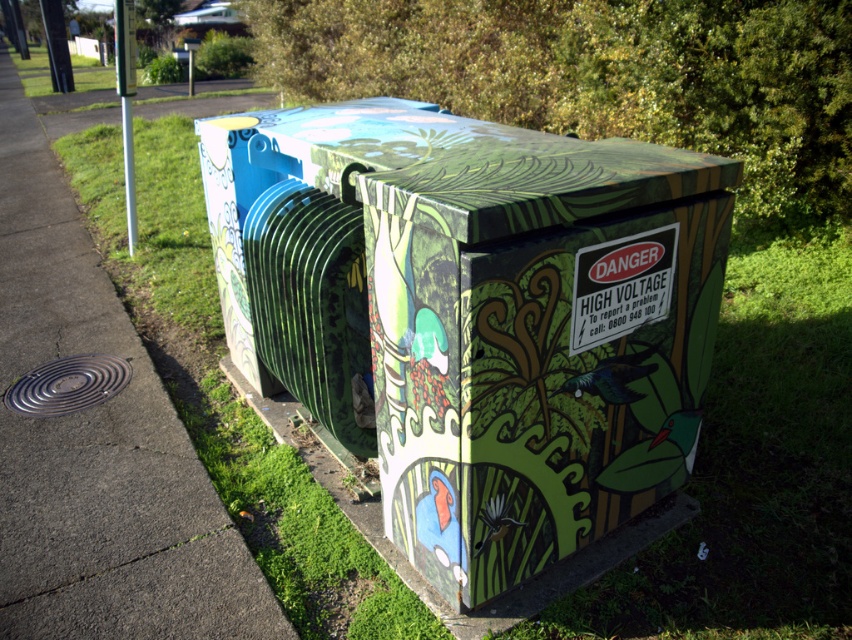
You are standing 5 feet away from the utility box. Is the point at coordinate point [467,557] on the utility box within your reach?

The distance of point [467,557] from viewer is 6.65 feet, so the point is 1.65 feet away from you, which is within reach.

You are a delivery person trying to park your 1.2 meter wide bike. You see the matte green painted box at center and the concrete sidewalk at lower left. Which area can accommodate your bike?

The concrete sidewalk at lower left can accommodate the bike since the matte green painted box at center is narrower than the concrete sidewalk at lower left.

You are standing on the sidewalk looking at the utility box. There is a point marked at coordinates [482,316]. What is located at that point?

The point at coordinates [482,316] is located on the matte green painted box at center.